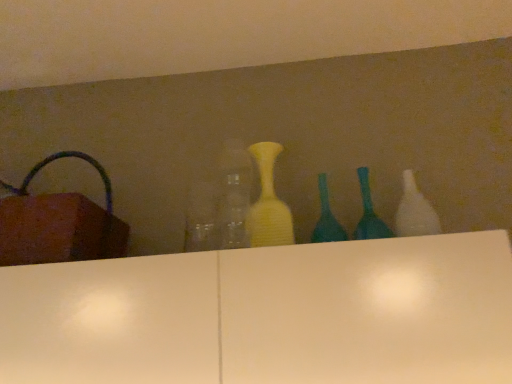
Question: Can you confirm if yellow matte vase at center, arranged as the 2th bottle when viewed from the left, is smaller than white glossy bottle at right, which is counted as the fifth bottle, starting from the left?

Choices:
 (A) yes
 (B) no

Answer: (B)

Question: From a real-world perspective, is yellow matte vase at center, arranged as the 2th bottle when viewed from the left, beneath white glossy bottle at right, arranged as the 1th bottle when viewed from the right?

Choices:
 (A) yes
 (B) no

Answer: (B)

Question: Considering the relative sizes of yellow matte vase at center, arranged as the 2th bottle when viewed from the left, and white glossy bottle at right, which is counted as the fifth bottle, starting from the left, in the image provided, is yellow matte vase at center, arranged as the 2th bottle when viewed from the left, bigger than white glossy bottle at right, which is counted as the fifth bottle, starting from the left,?

Choices:
 (A) yes
 (B) no

Answer: (A)

Question: Considering the relative positions of yellow matte vase at center, arranged as the 2th bottle when viewed from the left, and white glossy bottle at right, arranged as the 1th bottle when viewed from the right, in the image provided, is yellow matte vase at center, arranged as the 2th bottle when viewed from the left, to the left of white glossy bottle at right, arranged as the 1th bottle when viewed from the right, from the viewer's perspective?

Choices:
 (A) no
 (B) yes

Answer: (B)

Question: Is yellow matte vase at center, the 4th bottle when ordered from right to left, at the right side of white glossy bottle at right, which is counted as the fifth bottle, starting from the left?

Choices:
 (A) no
 (B) yes

Answer: (A)

Question: Is yellow matte vase at center, arranged as the 2th bottle when viewed from the left, oriented towards white glossy bottle at right, arranged as the 1th bottle when viewed from the right?

Choices:
 (A) yes
 (B) no

Answer: (B)

Question: Can you confirm if white glossy bottle at right, arranged as the 1th bottle when viewed from the right, is wider than yellow matte vase at center, the 4th bottle when ordered from right to left?

Choices:
 (A) no
 (B) yes

Answer: (A)

Question: From a real-world perspective, is white glossy bottle at right, arranged as the 1th bottle when viewed from the right, physically below yellow matte vase at center, the 4th bottle when ordered from right to left?

Choices:
 (A) yes
 (B) no

Answer: (A)

Question: Considering the relative sizes of white glossy bottle at right, which is counted as the fifth bottle, starting from the left, and yellow matte vase at center, the 4th bottle when ordered from right to left, in the image provided, is white glossy bottle at right, which is counted as the fifth bottle, starting from the left, thinner than yellow matte vase at center, the 4th bottle when ordered from right to left,?

Choices:
 (A) no
 (B) yes

Answer: (B)

Question: From a real-world perspective, is white glossy bottle at right, which is counted as the fifth bottle, starting from the left, positioned over yellow matte vase at center, the 4th bottle when ordered from right to left, based on gravity?

Choices:
 (A) no
 (B) yes

Answer: (A)

Question: From the image's perspective, is white glossy bottle at right, which is counted as the fifth bottle, starting from the left, under yellow matte vase at center, arranged as the 2th bottle when viewed from the left?

Choices:
 (A) yes
 (B) no

Answer: (A)

Question: Is white glossy bottle at right, arranged as the 1th bottle when viewed from the right, oriented towards yellow matte vase at center, the 4th bottle when ordered from right to left?

Choices:
 (A) no
 (B) yes

Answer: (A)

Question: Does transparent glass bottle at center, which appears as the 1th bottle when viewed from the left, have a lesser width compared to teal glass bottle at center, the 3th bottle when ordered from left to right?

Choices:
 (A) yes
 (B) no

Answer: (B)